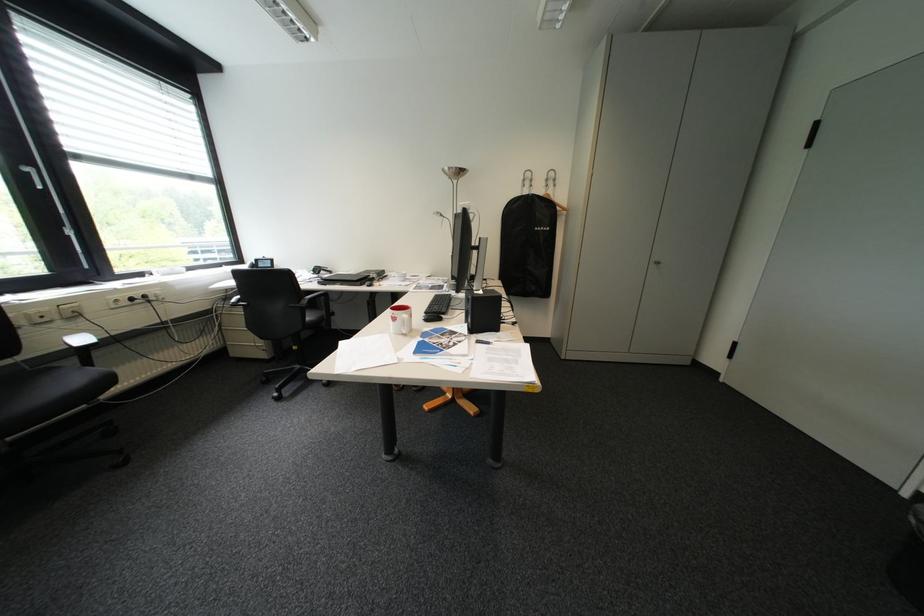
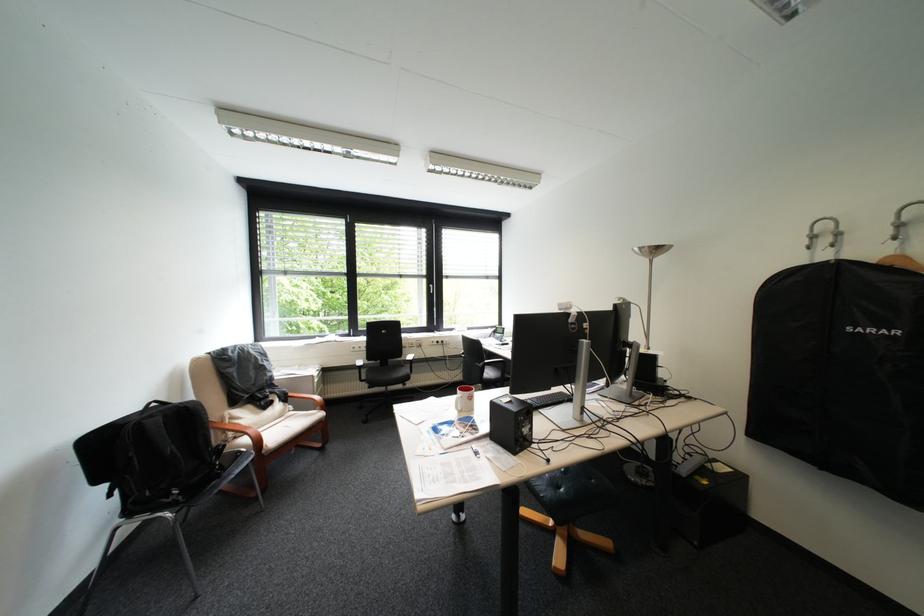
Where in the second image is the point corresponding to [540,184] from the first image?

(837, 241)